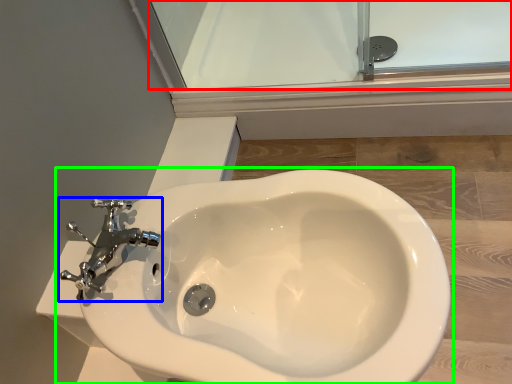
Question: Estimate the real-world distances between objects in this image. Which object is closer to glass door (highlighted by a red box), tap (highlighted by a blue box) or toilet (highlighted by a green box)?

Choices:
 (A) tap
 (B) toilet

Answer: (B)